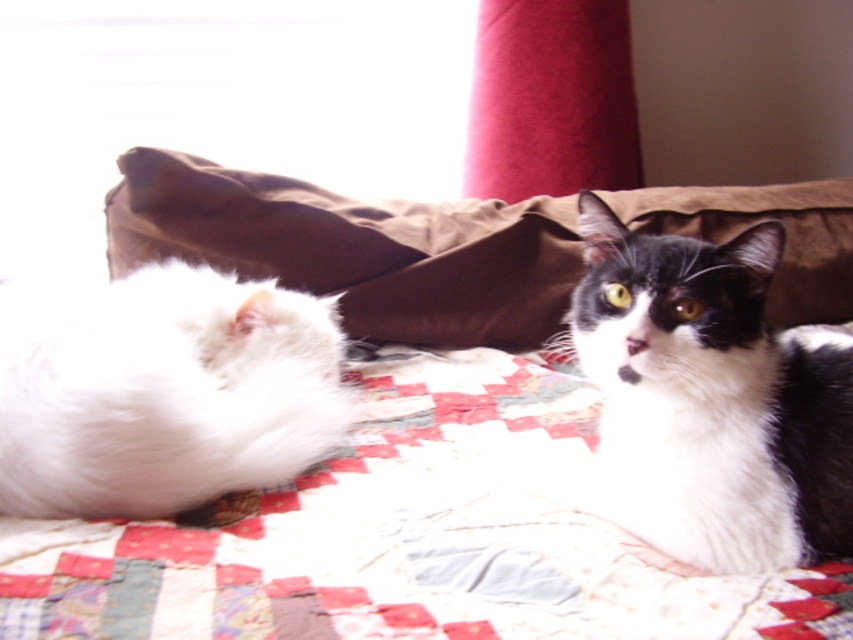
Between black and white fur cat at upper right and white fluffy cat at left, which one has more height?

With more height is black and white fur cat at upper right.

Can you confirm if black and white fur cat at upper right is shorter than white fluffy cat at left?

No, black and white fur cat at upper right is not shorter than white fluffy cat at left.

From the picture: Measure the distance between point (781, 468) and camera.

Point (781, 468) and camera are 22.90 inches apart.

Locate an element on the screen. black and white fur cat at upper right is located at coordinates (711, 400).

Is brown fabric pillow at center positioned behind white fluffy cat at left?

Yes, brown fabric pillow at center is further from the viewer.

Does brown fabric pillow at center have a greater height compared to white fluffy cat at left?

Yes.

Is point (312, 211) farther from viewer compared to point (24, 374)?

Yes, point (312, 211) is behind point (24, 374).

Where is `brown fabric pillow at center`? The image size is (853, 640). brown fabric pillow at center is located at coordinates (357, 250).

The width and height of the screenshot is (853, 640). What do you see at coordinates (711, 400) in the screenshot?
I see `black and white fur cat at upper right` at bounding box center [711, 400].

Can you confirm if black and white fur cat at upper right is positioned to the left of brown fabric pillow at center?

No, black and white fur cat at upper right is not to the left of brown fabric pillow at center.

Find the location of a particular element. The height and width of the screenshot is (640, 853). black and white fur cat at upper right is located at coordinates (711, 400).